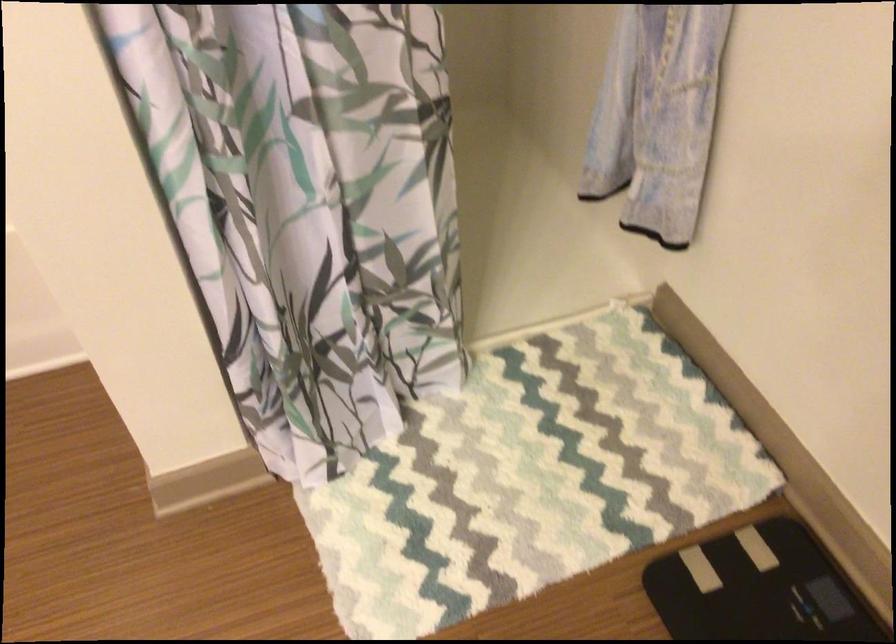
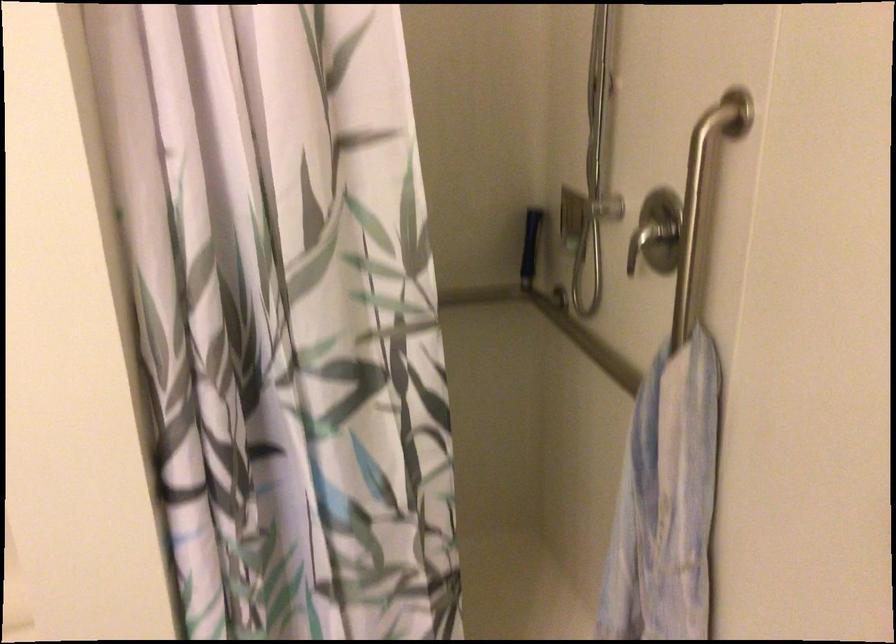
Question: The images are taken continuously from a first-person perspective. In which direction is your viewpoint rotating?

Choices:
 (A) Left
 (B) Right
 (C) Up
 (D) Down

Answer: (C)